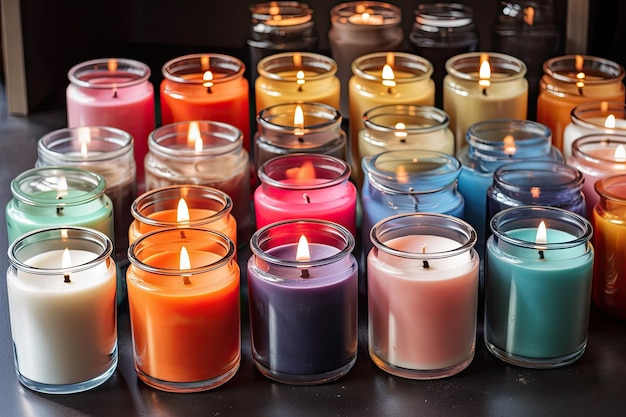
Identify the location of two leftmost columns of candles. (118, 87), (94, 150), (73, 208), (69, 265), (165, 266), (168, 200), (193, 148), (187, 82).